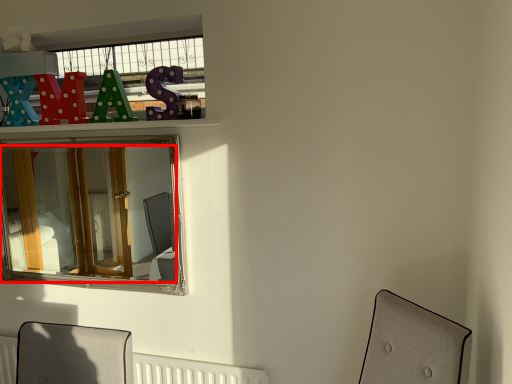
Question: From the image's perspective, where is mirror (annotated by the red box) located relative to radiator?

Choices:
 (A) below
 (B) above

Answer: (B)